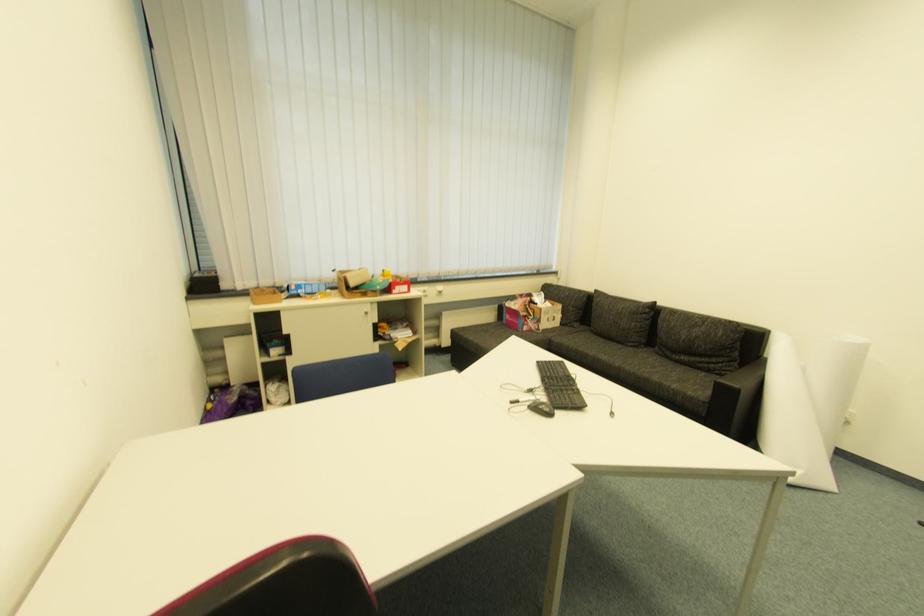
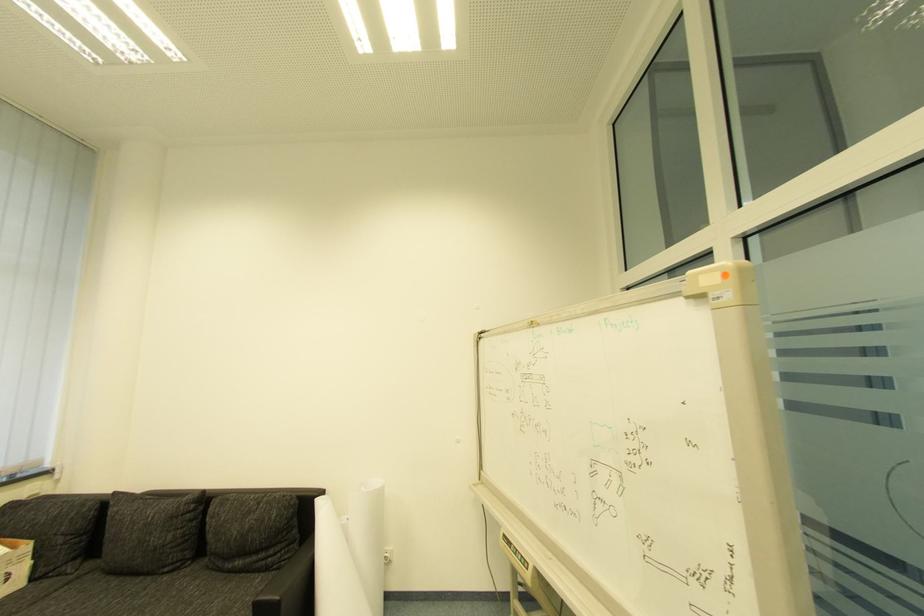
Question: The camera is either moving clockwise (left) or counter-clockwise (right) around the object. The first image is from the beginning of the video and the second image is from the end. Is the camera moving left or right when shooting the video?

Choices:
 (A) Left
 (B) Right

Answer: (A)